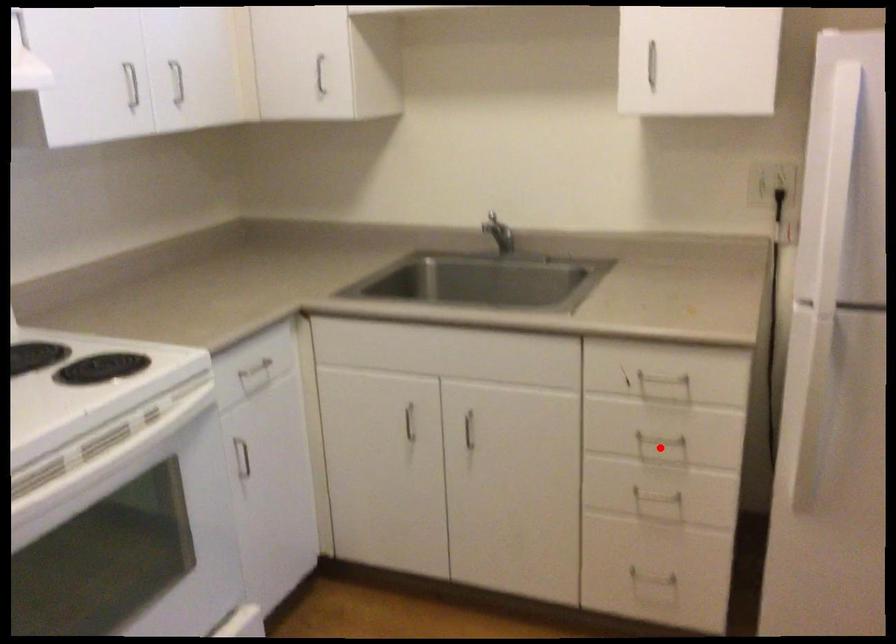
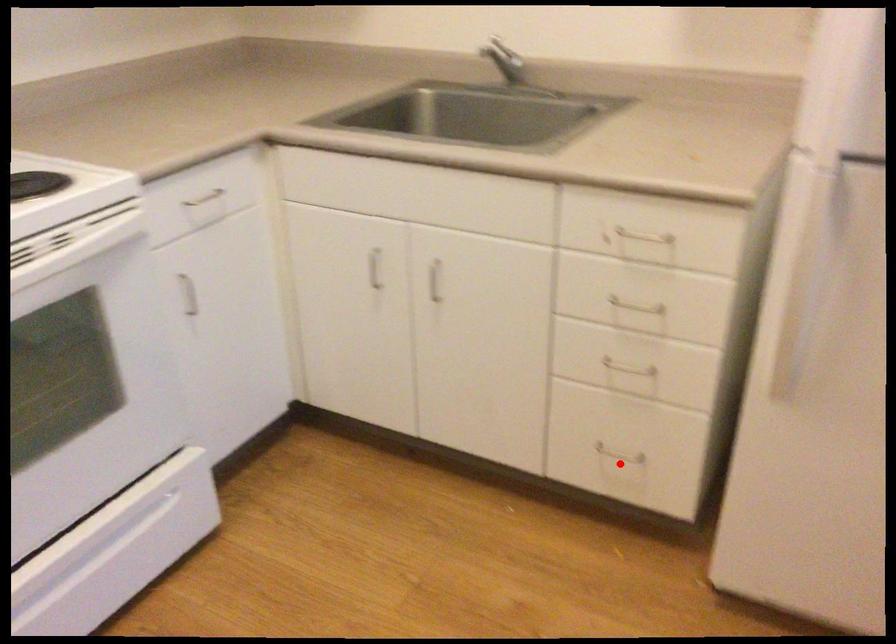
I am providing you with two images of the same scene from different viewpoints. A red point is marked on the first image and another point is marked on the second image. Does the point marked in image1 correspond to the same location as the one in image2?

No